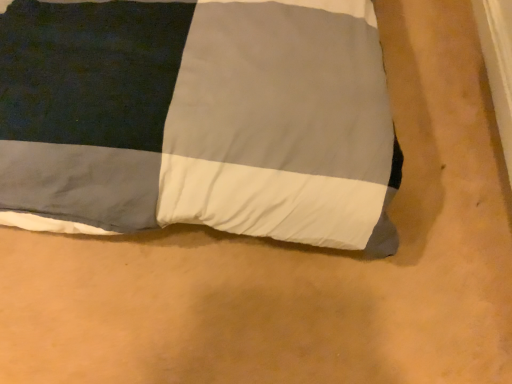
This screenshot has width=512, height=384. I want to click on white soft pillow at center, so click(x=198, y=119).

The image size is (512, 384). What do you see at coordinates (198, 119) in the screenshot?
I see `white soft pillow at center` at bounding box center [198, 119].

Where is `white soft pillow at center`? The height and width of the screenshot is (384, 512). white soft pillow at center is located at coordinates (198, 119).